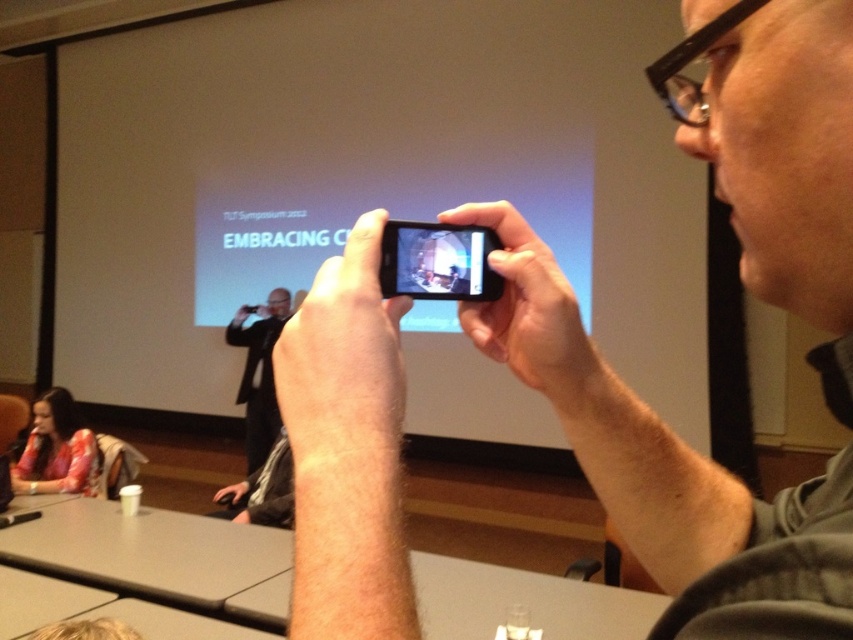
Can you confirm if black matte phone at center is wider than floral fabric shirt at lower left?

No.

Is point (846, 168) closer to camera compared to point (65, 396)?

Yes, it is in front of point (65, 396).

Image resolution: width=853 pixels, height=640 pixels. Find the location of `black matte phone at center`. black matte phone at center is located at coordinates (666, 470).

I want to click on black matte phone at center, so click(666, 470).

Does point (718, 84) come closer to viewer compared to point (502, 289)?

That is True.

Identify the location of black matte phone at center. (666, 470).

Who is taller, black matte phone at center or dark gray suit at center?

dark gray suit at center

Which is above, black matte phone at center or dark gray suit at center?

black matte phone at center is above.

Measure the distance between point (708,493) and camera.

A distance of 24.60 inches exists between point (708,493) and camera.

At what (x,y) coordinates should I click in order to perform the action: click on black matte phone at center. Please return your answer as a coordinate pair (x, y). This screenshot has width=853, height=640. Looking at the image, I should click on (666, 470).